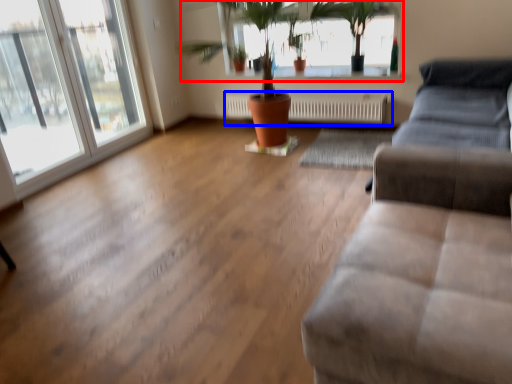
Question: Which point is closer to the camera, bay window (highlighted by a red box) or radiator (highlighted by a blue box)?

Choices:
 (A) bay window
 (B) radiator

Answer: (A)